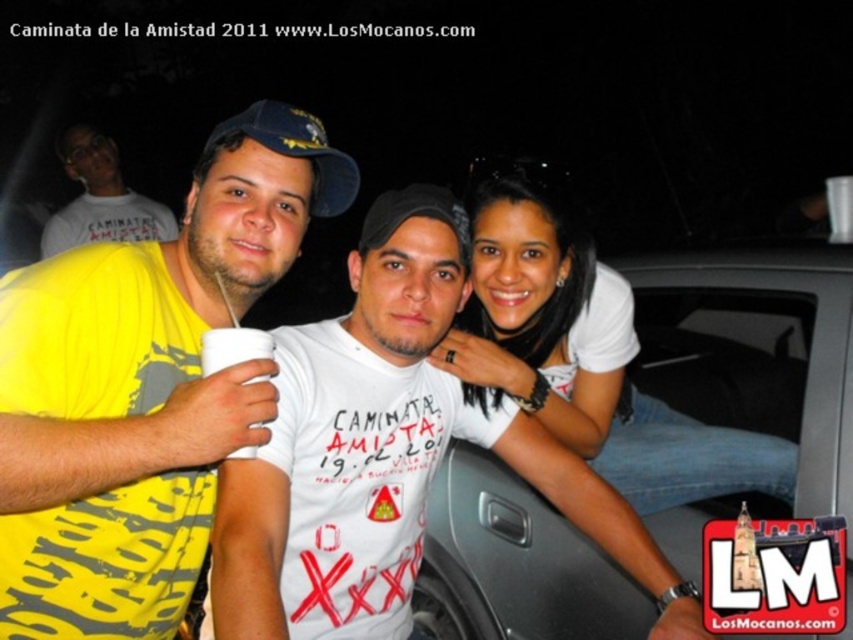
Does white matte shirt at center have a lesser width compared to blue fabric baseball cap at center?

No, white matte shirt at center is not thinner than blue fabric baseball cap at center.

The image size is (853, 640). Describe the element at coordinates (584, 349) in the screenshot. I see `white matte shirt at center` at that location.

Is point (640, 508) less distant than point (294, 115)?

No, it is not.

This screenshot has width=853, height=640. I want to click on white matte shirt at center, so click(584, 349).

Is point (117, 461) less distant than point (64, 220)?

Yes.

Between yellow matte t-shirt at left and white matte t-shirt at upper left, which one is positioned higher?

Positioned higher is white matte t-shirt at upper left.

Image resolution: width=853 pixels, height=640 pixels. What are the coordinates of `yellow matte t-shirt at left` in the screenshot? It's located at (143, 387).

Locate an element on the screen. The width and height of the screenshot is (853, 640). yellow matte t-shirt at left is located at coordinates (143, 387).

Who is more distant from viewer, (97,212) or (335,177)?

The point (97,212) is behind.

Is white matte t-shirt at upper left to the right of blue fabric baseball cap at center from the viewer's perspective?

In fact, white matte t-shirt at upper left is to the left of blue fabric baseball cap at center.

Who is more forward, (62, 145) or (344, 193)?

Point (344, 193)

Identify the location of white matte t-shirt at upper left. (100, 198).